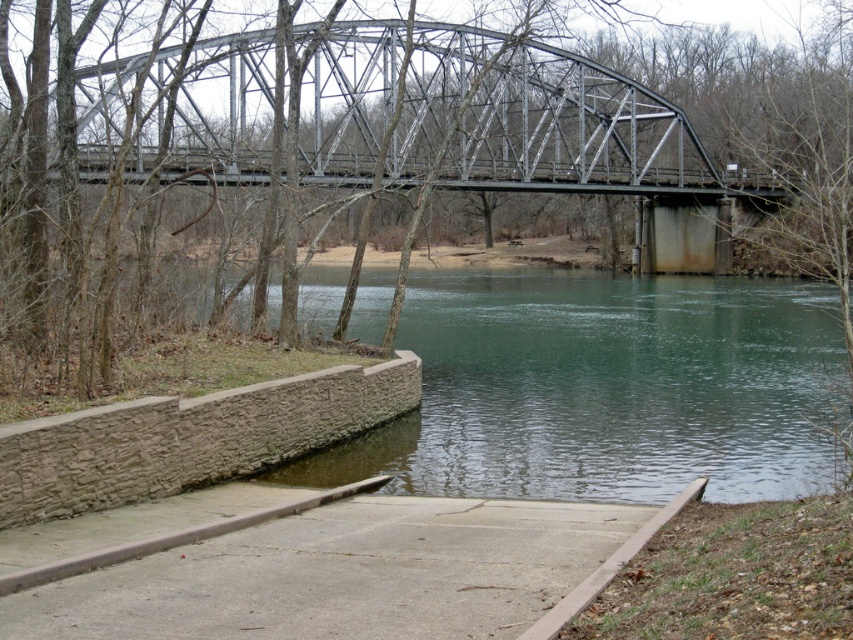
Question: Does metallic gray bridge at upper center have a larger size compared to concrete at center?

Choices:
 (A) yes
 (B) no

Answer: (A)

Question: Is metallic gray bridge at upper center to the left of concrete at center from the viewer's perspective?

Choices:
 (A) yes
 (B) no

Answer: (B)

Question: Which point is farther to the camera?

Choices:
 (A) (137, 80)
 (B) (370, 573)

Answer: (A)

Question: Among these objects, which one is nearest to the camera?

Choices:
 (A) metallic gray bridge at upper center
 (B) concrete at center

Answer: (B)

Question: Is the position of metallic gray bridge at upper center less distant than that of concrete at center?

Choices:
 (A) yes
 (B) no

Answer: (B)